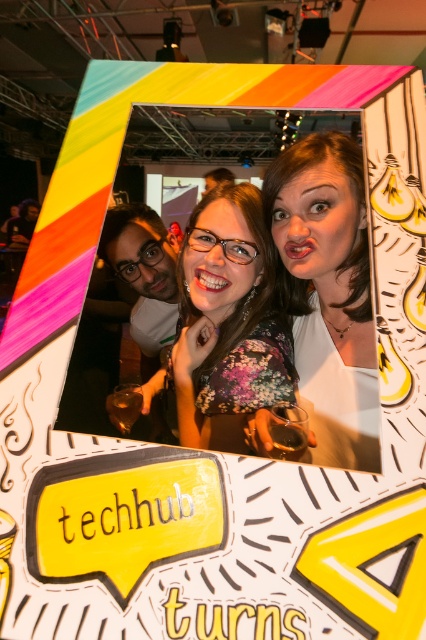
Is floral fabric dress at center taller than matte white man at left?

In fact, floral fabric dress at center may be shorter than matte white man at left.

Does point (212, 381) lie in front of point (143, 241)?

Yes, point (212, 381) is in front of point (143, 241).

This screenshot has height=640, width=426. I want to click on floral fabric dress at center, so click(x=227, y=323).

Does matte white face at center have a lesser height compared to floral fabric dress at center?

Incorrect, matte white face at center's height does not fall short of floral fabric dress at center's.

Locate an element on the screen. matte white face at center is located at coordinates (328, 292).

Between matte white face at center and matte white man at left, which one has less height?

With less height is matte white face at center.

Based on the photo, does matte white face at center have a smaller size compared to matte white man at left?

Yes, matte white face at center is smaller than matte white man at left.

Identify the location of matte white face at center. 328,292.